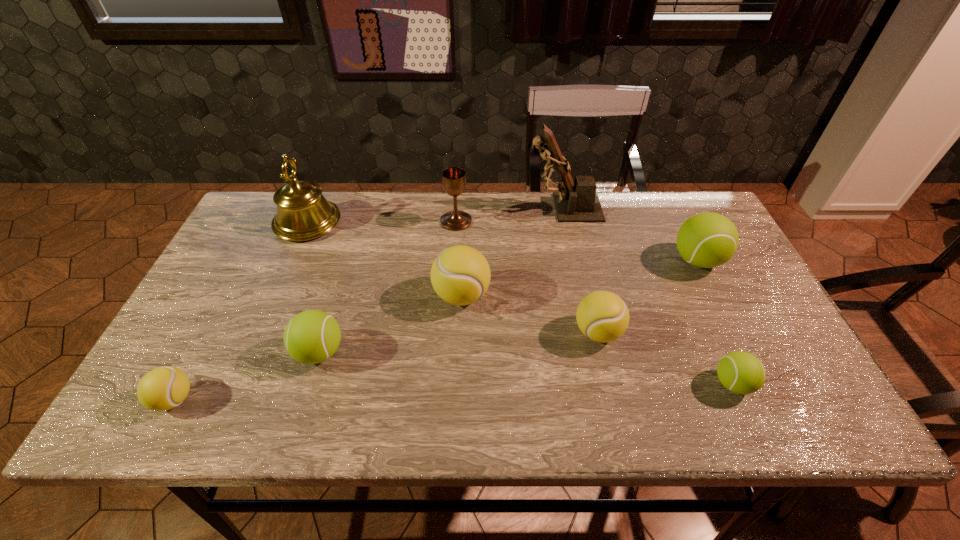
In order to click on vacant space located on the right of the second yellow tennis ball from right to left in this screenshot , I will do `click(529, 295)`.

Find the location of a particular element. This screenshot has height=540, width=960. free spot located on the left of the farthest green tennis ball is located at coordinates (546, 260).

Where is `vacant point located 0.100m on the front of the leftmost green tennis ball`? This screenshot has height=540, width=960. vacant point located 0.100m on the front of the leftmost green tennis ball is located at coordinates (300, 416).

Locate an element on the screen. The height and width of the screenshot is (540, 960). free space located 0.360m on the right of the rightmost yellow tennis ball is located at coordinates pos(771,332).

Locate an element on the screen. vacant space located on the front of the smallest green tennis ball is located at coordinates (751, 425).

Find the location of a particular element. Image resolution: width=960 pixels, height=540 pixels. free location located on the back of the leftmost tennis ball is located at coordinates (250, 257).

Where is `figurine that is positioned at the far edge`? figurine that is positioned at the far edge is located at coordinates (578, 202).

Image resolution: width=960 pixels, height=540 pixels. I want to click on bell located in the far edge section of the desktop, so click(x=303, y=213).

Identify the location of chalice present at the far edge. The image size is (960, 540). (454, 181).

This screenshot has width=960, height=540. What are the coordinates of `bell present at the left edge` in the screenshot? It's located at (303, 213).